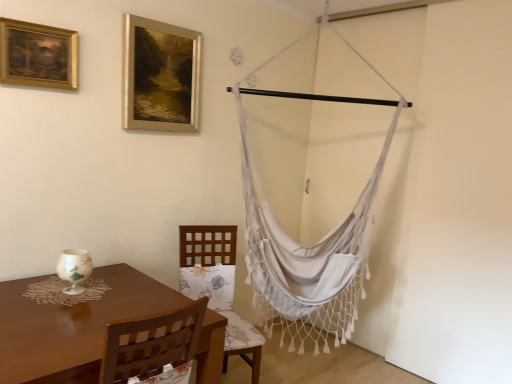
This screenshot has height=384, width=512. Find the location of `blank space situated above gold metallic picture frame at upper center, which is counted as the second picture frame, starting from the front (from a real-world perspective)`. blank space situated above gold metallic picture frame at upper center, which is counted as the second picture frame, starting from the front (from a real-world perspective) is located at coordinates click(164, 21).